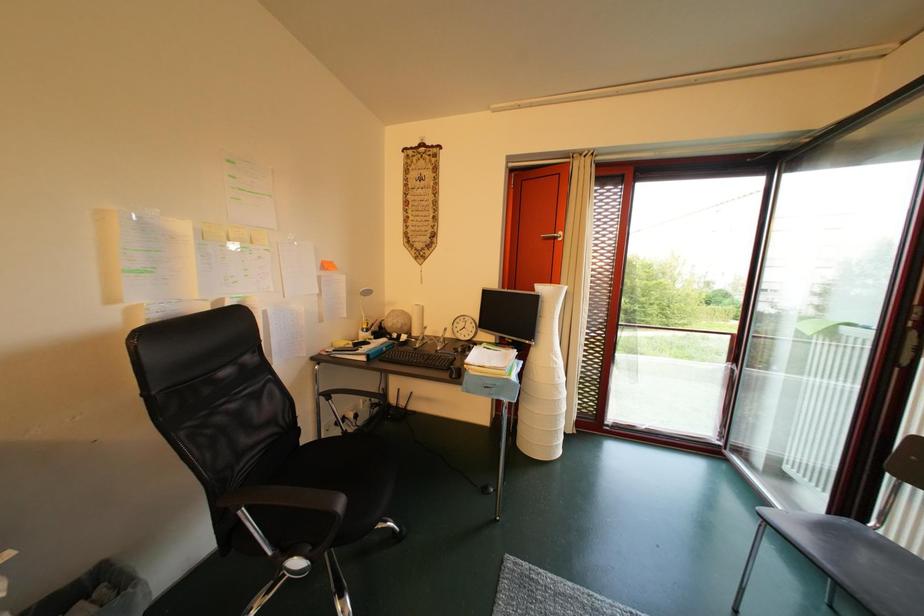
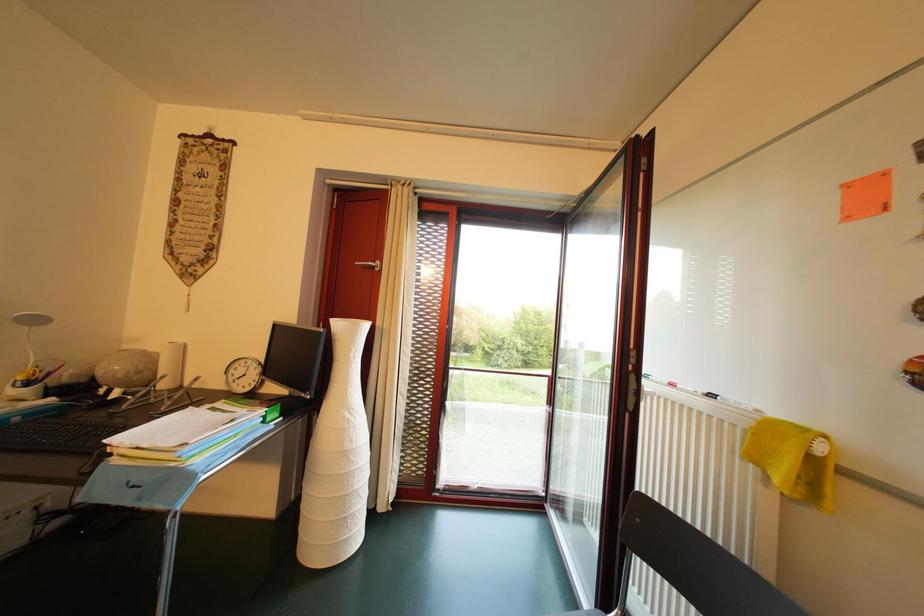
Question: What movement of the cameraman would produce the second image?

Choices:
 (A) Left
 (B) Right
 (C) Forward
 (D) Backward

Answer: (B)